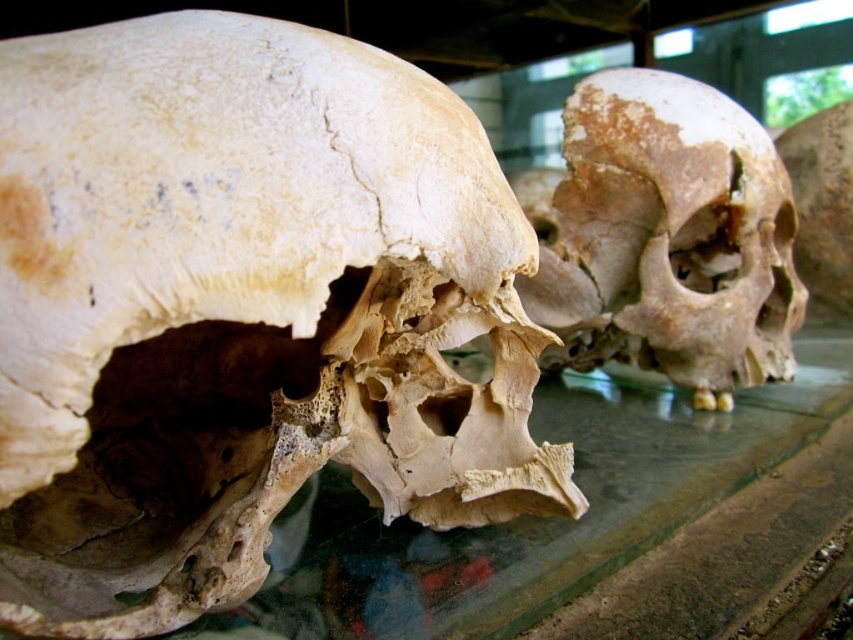
Between transparent glass table at center and brown porous skull at right, which one is positioned lower?

transparent glass table at center is lower down.

Is transparent glass table at center closer to camera compared to brown porous skull at right?

Yes, transparent glass table at center is in front of brown porous skull at right.

Where is `transparent glass table at center`? transparent glass table at center is located at coordinates (534, 516).

Is bone-like skull at left taller than transparent glass table at center?

Yes.

Can you confirm if bone-like skull at left is thinner than transparent glass table at center?

Correct, bone-like skull at left's width is less than transparent glass table at center's.

At what (x,y) coordinates should I click in order to perform the action: click on bone-like skull at left. Please return your answer as a coordinate pair (x, y). The width and height of the screenshot is (853, 640). Looking at the image, I should click on (242, 310).

Find the location of a particular element. Image resolution: width=853 pixels, height=640 pixels. bone-like skull at left is located at coordinates (242, 310).

Does bone-like skull at left appear on the left side of brown porous skull at right?

Yes, bone-like skull at left is to the left of brown porous skull at right.

Is point (258, 436) more distant than point (566, 244)?

No, (258, 436) is closer to viewer.

Identify the location of bone-like skull at left. The width and height of the screenshot is (853, 640). (242, 310).